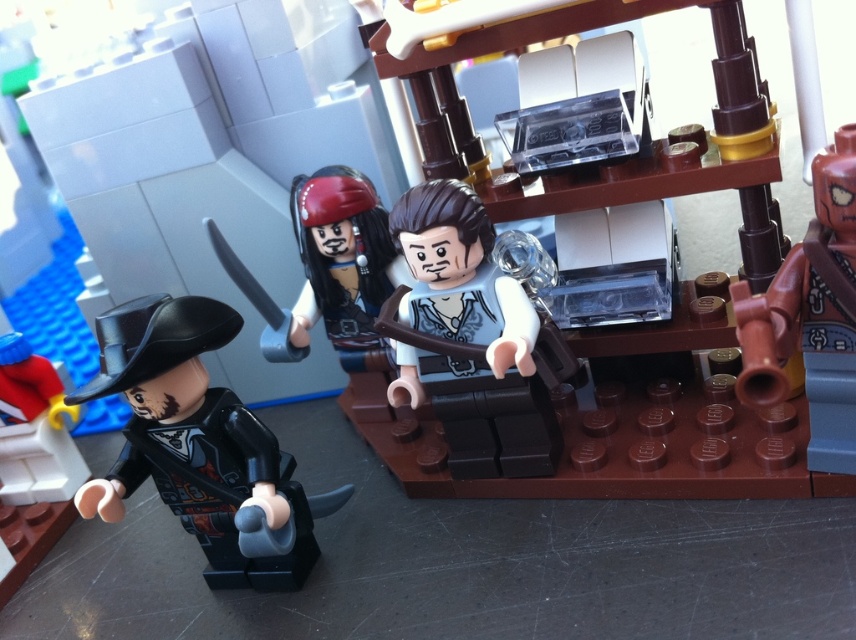
Can you confirm if smooth gray vest at center is wider than brown matte cannon at right?

Correct, the width of smooth gray vest at center exceeds that of brown matte cannon at right.

Between smooth gray vest at center and brown matte cannon at right, which one has less height?

brown matte cannon at right

Between point (518, 432) and point (840, 321), which one is positioned behind?

The point (518, 432) is behind.

Where is `smooth gray vest at center`? This screenshot has height=640, width=856. smooth gray vest at center is located at coordinates (467, 339).

Describe the element at coordinates (200, 445) in the screenshot. I see `black matte pirate hat at left` at that location.

Where is `black matte pirate hat at left`? black matte pirate hat at left is located at coordinates (200, 445).

Measure the distance between black matte pirate hat at left and camera.

black matte pirate hat at left is 27.79 inches away from camera.

Which is more to the left, black matte pirate hat at left or smooth gray vest at center?

From the viewer's perspective, black matte pirate hat at left appears more on the left side.

Find the location of `black matte pirate hat at left`. black matte pirate hat at left is located at coordinates (200, 445).